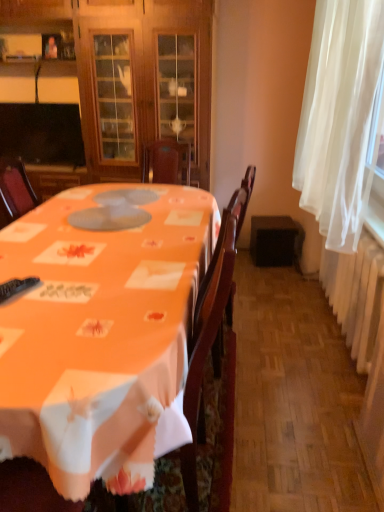
Where is `wooden cabinet at center`? The height and width of the screenshot is (512, 384). wooden cabinet at center is located at coordinates (132, 75).

The image size is (384, 512). Find the location of `white sheer curtain at right`. white sheer curtain at right is located at coordinates (340, 117).

What do you see at coordinates (16, 287) in the screenshot?
I see `black plastic remote control at lower left` at bounding box center [16, 287].

Locate an element on the screen. The width and height of the screenshot is (384, 512). orange fabric table at center is located at coordinates (101, 331).

Measure the distance between orange fabric table at center and camera.

The distance of orange fabric table at center from camera is 88.23 centimeters.

Identify the location of wooden cabinet at center. (132, 75).

Which object is further away from the camera, wooden cabinet at center or white sheer curtain at right?

Positioned behind is wooden cabinet at center.

From the image's perspective, between wooden cabinet at center and white sheer curtain at right, which one is located above?

wooden cabinet at center appears higher in the image.

Can you confirm if wooden cabinet at center is wider than white sheer curtain at right?

Indeed, wooden cabinet at center has a greater width compared to white sheer curtain at right.

Is wooden cabinet at center oriented away from white sheer curtain at right?

No, wooden cabinet at center's orientation is not away from white sheer curtain at right.

Based on the photo, is black plastic remote control at lower left oriented towards white sheer curtain at right?

No, black plastic remote control at lower left is not turned towards white sheer curtain at right.

Which object is positioned more to the left, black plastic remote control at lower left or white sheer curtain at right?

black plastic remote control at lower left.

Does black plastic remote control at lower left lie in front of white sheer curtain at right?

No, black plastic remote control at lower left is further to the viewer.

Considering the relative sizes of black plastic remote control at lower left and white sheer curtain at right in the image provided, is black plastic remote control at lower left wider than white sheer curtain at right?

In fact, black plastic remote control at lower left might be narrower than white sheer curtain at right.

From the image's perspective, between orange fabric table at center and wooden cabinet at center, which one is located above?

wooden cabinet at center is shown above in the image.

Considering the relative positions of orange fabric table at center and wooden cabinet at center in the image provided, is orange fabric table at center to the left of wooden cabinet at center from the viewer's perspective?

Incorrect, orange fabric table at center is not on the left side of wooden cabinet at center.

Is orange fabric table at center bigger than wooden cabinet at center?

Correct, orange fabric table at center is larger in size than wooden cabinet at center.

This screenshot has height=512, width=384. In order to click on desk that appears below the wooden cabinet at center (from a real-world perspective) in this screenshot , I will do `click(101, 331)`.

From a real-world perspective, is white sheer curtain at right physically located above or below black plastic remote control at lower left?

In terms of real-world spatial position, white sheer curtain at right is above black plastic remote control at lower left.

Could you tell me if white sheer curtain at right is turned towards black plastic remote control at lower left?

Yes, white sheer curtain at right is aimed at black plastic remote control at lower left.

How different are the orientations of white sheer curtain at right and black plastic remote control at lower left in degrees?

The facing directions of white sheer curtain at right and black plastic remote control at lower left are 70.6 degrees apart.

Does white sheer curtain at right have a greater height compared to wooden cabinet at center?

No, white sheer curtain at right is not taller than wooden cabinet at center.

From the picture: Is white sheer curtain at right positioned beyond the bounds of wooden cabinet at center?

white sheer curtain at right lies outside wooden cabinet at center's area.

Where is `cabinetry above the white sheer curtain at right (from the image's perspective)`? The image size is (384, 512). cabinetry above the white sheer curtain at right (from the image's perspective) is located at coordinates (132, 75).

Could you tell me if white sheer curtain at right is turned towards wooden cabinet at center?

Yes, white sheer curtain at right is turned towards wooden cabinet at center.

There is a black plastic remote control at lower left. Where is `cabinetry above it (from a real-world perspective)`? The height and width of the screenshot is (512, 384). cabinetry above it (from a real-world perspective) is located at coordinates (132, 75).

Does black plastic remote control at lower left appear on the right side of wooden cabinet at center?

Indeed, black plastic remote control at lower left is positioned on the right side of wooden cabinet at center.

Considering the points (9, 281) and (117, 101), which point is behind, point (9, 281) or point (117, 101)?

The point (117, 101) is more distant.

Does black plastic remote control at lower left contain orange fabric table at center?

No.

In the scene shown: Which point is more distant from viewer, (8, 283) or (14, 261)?

The point (14, 261) is behind.

Which of these two, black plastic remote control at lower left or orange fabric table at center, is bigger?

orange fabric table at center.

You are a GUI agent. You are given a task and a screenshot of the screen. Output one action in this format:
    pyautogui.click(x=<x>, y=<y>)
    Task: Click on the curtain located on the right of wooden cabinet at center
    
    Given the screenshot: What is the action you would take?
    pyautogui.click(x=340, y=117)

This screenshot has width=384, height=512. In order to click on curtain above the black plastic remote control at lower left (from the image's perspective) in this screenshot , I will do `click(340, 117)`.

Estimate the real-world distances between objects in this image. Which object is closer to orange fabric table at center, white sheer curtain at right or wooden cabinet at center?

Among the two, white sheer curtain at right is located nearer to orange fabric table at center.

Which object lies further to the anchor point white sheer curtain at right, black plastic remote control at lower left or wooden cabinet at center?

wooden cabinet at center is positioned further to the anchor white sheer curtain at right.

Looking at the image, which one is located closer to black plastic remote control at lower left, wooden cabinet at center or white sheer curtain at right?

Among the two, white sheer curtain at right is located nearer to black plastic remote control at lower left.

From the image, which object appears to be nearer to orange fabric table at center, white sheer curtain at right or black plastic remote control at lower left?

black plastic remote control at lower left is positioned closer to the anchor orange fabric table at center.

Which object lies nearer to the anchor point black plastic remote control at lower left, wooden cabinet at center or orange fabric table at center?

Among the two, orange fabric table at center is located nearer to black plastic remote control at lower left.

Estimate the real-world distances between objects in this image. Which object is further from wooden cabinet at center, orange fabric table at center or white sheer curtain at right?

white sheer curtain at right is further to wooden cabinet at center.

Which object lies nearer to the anchor point black plastic remote control at lower left, white sheer curtain at right or wooden cabinet at center?

white sheer curtain at right.

Estimate the real-world distances between objects in this image. Which object is closer to wooden cabinet at center, orange fabric table at center or black plastic remote control at lower left?

orange fabric table at center lies closer to wooden cabinet at center than the other object.

The image size is (384, 512). Identify the location of curtain positioned between orange fabric table at center and wooden cabinet at center from near to far. (340, 117).

Identify the location of remote control between white sheer curtain at right and wooden cabinet at center in the front-back direction. (16, 287).

Locate an element on the screen. desk between black plastic remote control at lower left and white sheer curtain at right is located at coordinates (101, 331).

You are a GUI agent. You are given a task and a screenshot of the screen. Output one action in this format:
    pyautogui.click(x=<x>, y=<y>)
    Task: Click on the remote control located between orange fabric table at center and wooden cabinet at center in the depth direction
    This screenshot has height=512, width=384.
    Given the screenshot: What is the action you would take?
    pyautogui.click(x=16, y=287)